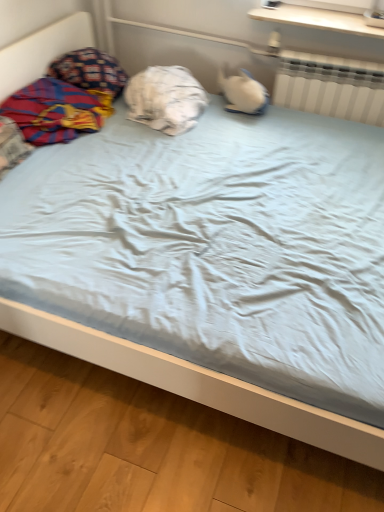
Measure the distance between plaid fabric blanket at left and camera.

The distance of plaid fabric blanket at left from camera is 6.09 feet.

Describe the element at coordinates (331, 86) in the screenshot. This screenshot has width=384, height=512. I see `white plastic radiator at upper right` at that location.

Where is `white wood shelf at upper center`? white wood shelf at upper center is located at coordinates (317, 19).

At what (x,y) coordinates should I click in order to perform the action: click on white cotton pillow at center, positioned as the 1th pillow in right-to-left order. Please return your answer as a coordinate pair (x, y). The width and height of the screenshot is (384, 512). Looking at the image, I should click on (165, 99).

From the image's perspective, which one is positioned higher, plaid fabric blanket at left or patterned fabric pillow at upper left, acting as the 1th pillow starting from the left?

From the image's view, patterned fabric pillow at upper left, acting as the 1th pillow starting from the left, is above.

Considering the sizes of objects plaid fabric blanket at left and patterned fabric pillow at upper left, positioned as the second pillow in right-to-left order, in the image provided, who is wider, plaid fabric blanket at left or patterned fabric pillow at upper left, positioned as the second pillow in right-to-left order,?

With larger width is plaid fabric blanket at left.

Is there a large distance between plaid fabric blanket at left and patterned fabric pillow at upper left, acting as the 1th pillow starting from the left?

No, plaid fabric blanket at left is not far away from patterned fabric pillow at upper left, acting as the 1th pillow starting from the left.

Is white cotton pillow at center, the 2th pillow from the left, wider or thinner than white plastic radiator at upper right?

white cotton pillow at center, the 2th pillow from the left, is wider than white plastic radiator at upper right.

Considering the positions of objects white cotton pillow at center, the 2th pillow from the left, and white plastic radiator at upper right in the image provided, who is more to the right, white cotton pillow at center, the 2th pillow from the left, or white plastic radiator at upper right?

Positioned to the right is white plastic radiator at upper right.

Between white cotton pillow at center, the 2th pillow from the left, and white plastic radiator at upper right, which one has smaller size?

Smaller between the two is white plastic radiator at upper right.

From the image's perspective, which one is positioned higher, white cotton pillow at center, positioned as the 1th pillow in right-to-left order, or white plastic radiator at upper right?

white plastic radiator at upper right is shown above in the image.

From a real-world perspective, does patterned fabric pillow at upper left, positioned as the second pillow in right-to-left order, sit lower than white cotton pillow at center, the 2th pillow from the left?

No, from a real-world perspective, patterned fabric pillow at upper left, positioned as the second pillow in right-to-left order, is not beneath white cotton pillow at center, the 2th pillow from the left.

Is patterned fabric pillow at upper left, acting as the 1th pillow starting from the left, not near white cotton pillow at center, the 2th pillow from the left?

No, patterned fabric pillow at upper left, acting as the 1th pillow starting from the left, is not far away from white cotton pillow at center, the 2th pillow from the left.

Between plaid fabric blanket at left and white wood shelf at upper center, which one has smaller size?

With smaller size is white wood shelf at upper center.

What's the angular difference between plaid fabric blanket at left and white wood shelf at upper center's facing directions?

They differ by 90.4 degrees in their facing directions.

Is point (47, 124) closer or farther from the camera than point (360, 18)?

Point (47, 124) is closer to the camera than point (360, 18).

From the image's perspective, is plaid fabric blanket at left above or below white wood shelf at upper center?

From the image's perspective, plaid fabric blanket at left appears below white wood shelf at upper center.

Identify the location of the 1st pillow in front of the white plastic radiator at upper right. (90, 70).

Is point (301, 109) more distant than point (106, 81)?

That is True.

From a real-world perspective, which object stands above the other?

From a 3D spatial view, patterned fabric pillow at upper left, positioned as the second pillow in right-to-left order, is above.

Is white plastic radiator at upper right not near patterned fabric pillow at upper left, positioned as the second pillow in right-to-left order?

Absolutely, white plastic radiator at upper right is distant from patterned fabric pillow at upper left, positioned as the second pillow in right-to-left order.

Can you tell me how much white wood shelf at upper center and patterned fabric pillow at upper left, acting as the 1th pillow starting from the left, differ in facing direction?

90.4 degrees.

Visually, is white wood shelf at upper center positioned to the left or to the right of patterned fabric pillow at upper left, positioned as the second pillow in right-to-left order?

From the image, it's evident that white wood shelf at upper center is to the right of patterned fabric pillow at upper left, positioned as the second pillow in right-to-left order.

Is patterned fabric pillow at upper left, acting as the 1th pillow starting from the left, at the back of white wood shelf at upper center?

That's not correct — white wood shelf at upper center is not looking away from patterned fabric pillow at upper left, acting as the 1th pillow starting from the left.

Considering the sizes of objects white wood shelf at upper center and patterned fabric pillow at upper left, acting as the 1th pillow starting from the left, in the image provided, who is wider, white wood shelf at upper center or patterned fabric pillow at upper left, acting as the 1th pillow starting from the left,?

Wider between the two is patterned fabric pillow at upper left, acting as the 1th pillow starting from the left.

Is patterned fabric pillow at upper left, acting as the 1th pillow starting from the left, beside white plastic radiator at upper right?

There is a gap between patterned fabric pillow at upper left, acting as the 1th pillow starting from the left, and white plastic radiator at upper right.

How far apart are patterned fabric pillow at upper left, positioned as the second pillow in right-to-left order, and white plastic radiator at upper right?

patterned fabric pillow at upper left, positioned as the second pillow in right-to-left order, is 1.06 meters away from white plastic radiator at upper right.

Could white plastic radiator at upper right be considered to be inside patterned fabric pillow at upper left, acting as the 1th pillow starting from the left?

No, white plastic radiator at upper right is not a part of patterned fabric pillow at upper left, acting as the 1th pillow starting from the left.

From the picture: What's the angular difference between patterned fabric pillow at upper left, positioned as the second pillow in right-to-left order, and white plastic radiator at upper right's facing directions?

The facing directions of patterned fabric pillow at upper left, positioned as the second pillow in right-to-left order, and white plastic radiator at upper right are 86.3 degrees apart.

Where is `the 2nd pillow positioned above the plaid fabric blanket at left (from the image's perspective)`? The image size is (384, 512). the 2nd pillow positioned above the plaid fabric blanket at left (from the image's perspective) is located at coordinates (90, 70).

You are a GUI agent. You are given a task and a screenshot of the screen. Output one action in this format:
    pyautogui.click(x=<x>, y=<y>)
    Task: Click on the radiator that appears below the white cotton pillow at center, positioned as the 1th pillow in right-to-left order (from a real-world perspective)
    This screenshot has height=512, width=384.
    Given the screenshot: What is the action you would take?
    pyautogui.click(x=331, y=86)

Based on their spatial positions, is patterned fabric pillow at upper left, acting as the 1th pillow starting from the left, or white cotton pillow at center, positioned as the 1th pillow in right-to-left order, further from white plastic radiator at upper right?

patterned fabric pillow at upper left, acting as the 1th pillow starting from the left, lies further to white plastic radiator at upper right than the other object.

When comparing their distances from patterned fabric pillow at upper left, acting as the 1th pillow starting from the left, does white wood shelf at upper center or white cotton pillow at center, positioned as the 1th pillow in right-to-left order, seem further?

white wood shelf at upper center lies further to patterned fabric pillow at upper left, acting as the 1th pillow starting from the left, than the other object.

Considering their positions, is white plastic radiator at upper right positioned closer to white wood shelf at upper center than white cotton pillow at center, positioned as the 1th pillow in right-to-left order?

Among the two, white plastic radiator at upper right is located nearer to white wood shelf at upper center.

Which object lies further to the anchor point white wood shelf at upper center, plaid fabric blanket at left or white plastic radiator at upper right?

plaid fabric blanket at left lies further to white wood shelf at upper center than the other object.

Estimate the real-world distances between objects in this image. Which object is closer to plaid fabric blanket at left, patterned fabric pillow at upper left, positioned as the second pillow in right-to-left order, or white wood shelf at upper center?

patterned fabric pillow at upper left, positioned as the second pillow in right-to-left order.

When comparing their distances from white cotton pillow at center, the 2th pillow from the left, does white wood shelf at upper center or plaid fabric blanket at left seem further?

white wood shelf at upper center is further to white cotton pillow at center, the 2th pillow from the left.

When comparing their distances from white cotton pillow at center, the 2th pillow from the left, does plaid fabric blanket at left or white wood shelf at upper center seem further?

Among the two, white wood shelf at upper center is located further to white cotton pillow at center, the 2th pillow from the left.

Considering their positions, is patterned fabric pillow at upper left, acting as the 1th pillow starting from the left, positioned closer to white cotton pillow at center, positioned as the 1th pillow in right-to-left order, than plaid fabric blanket at left?

Among the two, patterned fabric pillow at upper left, acting as the 1th pillow starting from the left, is located nearer to white cotton pillow at center, positioned as the 1th pillow in right-to-left order.

Find the location of a particular element. The width and height of the screenshot is (384, 512). window sill between white cotton pillow at center, the 2th pillow from the left, and white plastic radiator at upper right is located at coordinates (317, 19).

Where is `window sill between patterned fabric pillow at upper left, positioned as the second pillow in right-to-left order, and white plastic radiator at upper right`? window sill between patterned fabric pillow at upper left, positioned as the second pillow in right-to-left order, and white plastic radiator at upper right is located at coordinates (317, 19).

Locate an element on the screen. The image size is (384, 512). pillow between patterned fabric pillow at upper left, acting as the 1th pillow starting from the left, and white plastic radiator at upper right is located at coordinates (165, 99).

Locate an element on the screen. pillow between plaid fabric blanket at left and white cotton pillow at center, positioned as the 1th pillow in right-to-left order, in the horizontal direction is located at coordinates (90, 70).